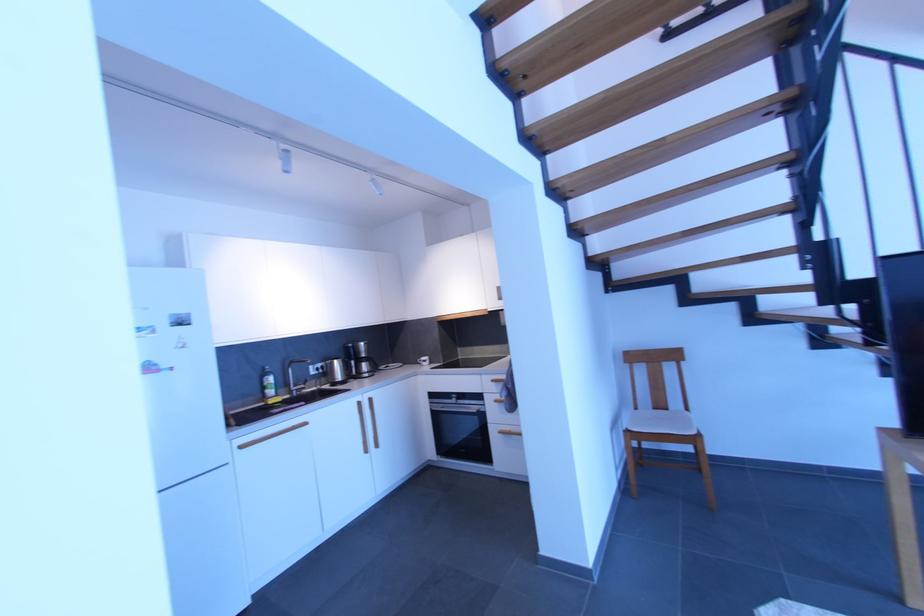
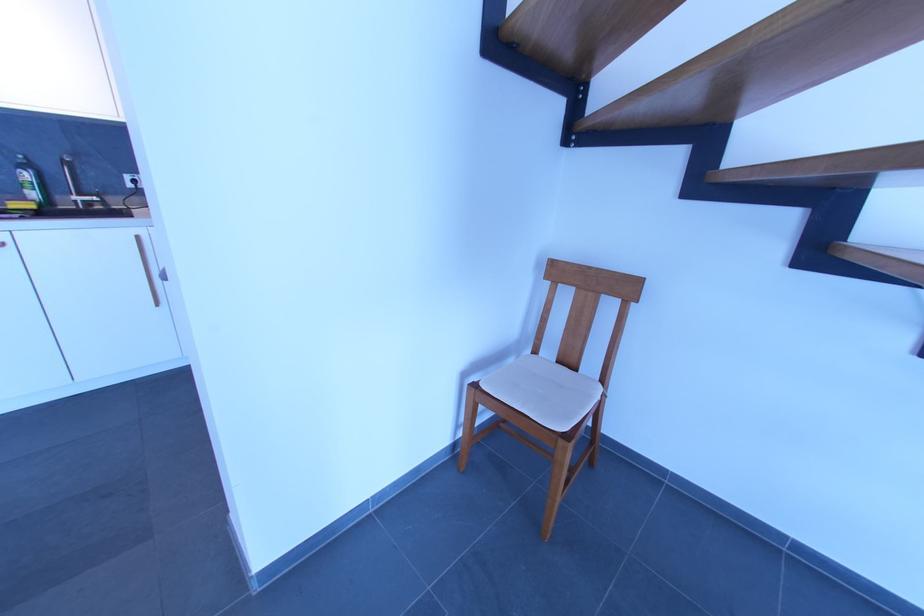
Locate, in the second image, the point that corresponds to point (271, 386) in the first image.

(26, 182)